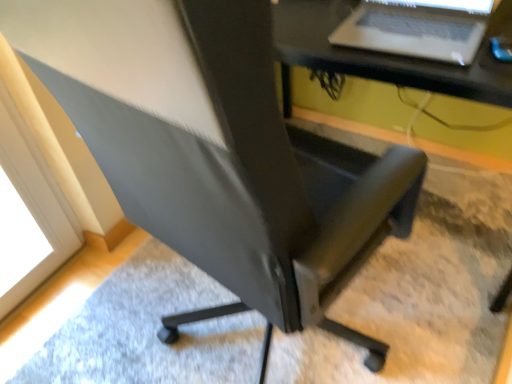
Question: Is point (288, 1) closer or farther from the camera than point (397, 14)?

Choices:
 (A) closer
 (B) farther

Answer: (B)

Question: Considering the positions of black plastic computer desk at center and silver metallic laptop at upper right in the image, is black plastic computer desk at center taller or shorter than silver metallic laptop at upper right?

Choices:
 (A) tall
 (B) short

Answer: (A)

Question: Looking at the image, does black plastic computer desk at center seem bigger or smaller compared to silver metallic laptop at upper right?

Choices:
 (A) small
 (B) big

Answer: (B)

Question: Is silver metallic laptop at upper right inside the boundaries of black plastic computer desk at center, or outside?

Choices:
 (A) outside
 (B) inside

Answer: (B)

Question: Visually, is silver metallic laptop at upper right positioned to the left or to the right of black plastic computer desk at center?

Choices:
 (A) left
 (B) right

Answer: (A)

Question: From their relative heights in the image, would you say silver metallic laptop at upper right is taller or shorter than black plastic computer desk at center?

Choices:
 (A) short
 (B) tall

Answer: (A)

Question: Is silver metallic laptop at upper right bigger or smaller than black plastic computer desk at center?

Choices:
 (A) big
 (B) small

Answer: (B)